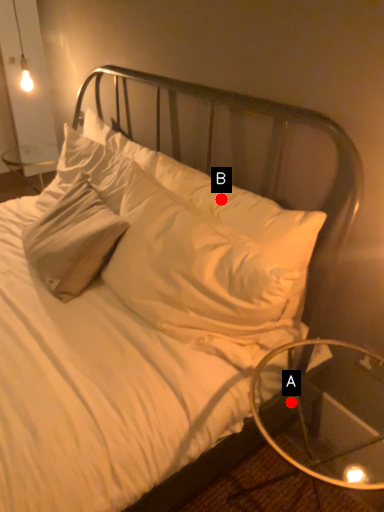
Question: Two points are circled on the image, labeled by A and B beside each circle. Among these points, which one is farthest from the camera?

Choices:
 (A) A is further
 (B) B is further

Answer: (A)